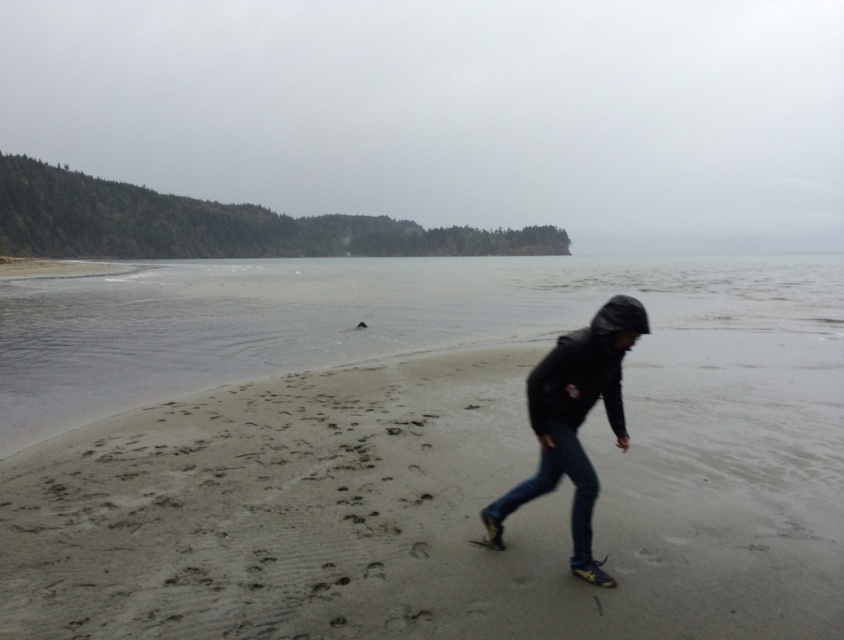
You are standing on the sandy beach at center and looking down at the dark blue jeans at lower center. Which object is closer to the ground?

The dark blue jeans at lower center are closer to the ground since they have a greater height than the sandy beach at center.

You are standing on the sandy beach at center and see the dark blue jeans at lower center. Which object is closer to you?

The sandy beach at center is closer to you because it is in front of the dark blue jeans at lower center.